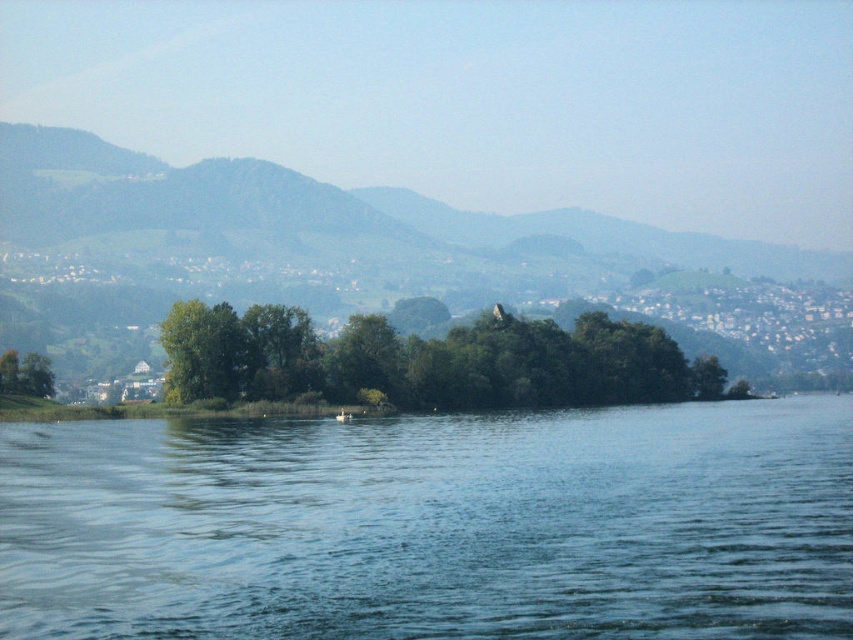
You are standing on the shore of the serene landscape and want to launch a small toy boat that is exactly the same size as the white plastic boat at center. Based on the scene, will your toy boat fit entirely within the width of the blue water at center without touching the edges?

The blue water at center has a larger width than the white plastic boat at center, so your toy boat will fit entirely within the width of the blue water at center without touching the edges.

You are a photographer planning to capture the green leafy trees at center and the white plastic boat at center in the same frame. Based on their sizes in the image, which object would appear wider when taking the photo?

The green leafy trees at center would appear wider in the photo because their width is larger than the white plastic boat at center according to the description.